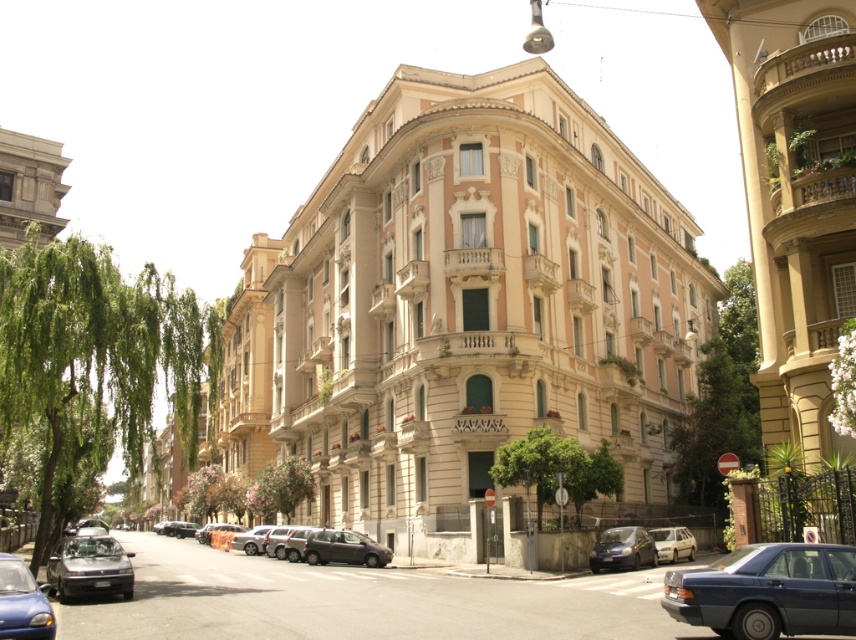
Question: Which of the following is the closest to the observer?

Choices:
 (A) shiny black sedan at lower left
 (B) matte blue car at lower left
 (C) matte black car at center
 (D) silver metallic sedan at center

Answer: (B)

Question: Does dark gray metallic car at center have a lesser width compared to shiny black car at lower left?

Choices:
 (A) no
 (B) yes

Answer: (B)

Question: Does shiny black sedan at center have a larger size compared to silver metallic sedan at center?

Choices:
 (A) no
 (B) yes

Answer: (A)

Question: Which point is closer to the camera taking this photo?

Choices:
 (A) (331, 538)
 (B) (80, 564)

Answer: (B)

Question: Considering the real-world distances, which object is closest to the matte blue car at lower left?

Choices:
 (A) matte black car at center
 (B) shiny black car at lower left

Answer: (A)

Question: In this image, where is silver metallic sedan at center located relative to shiny black car at lower left?

Choices:
 (A) left
 (B) right

Answer: (B)